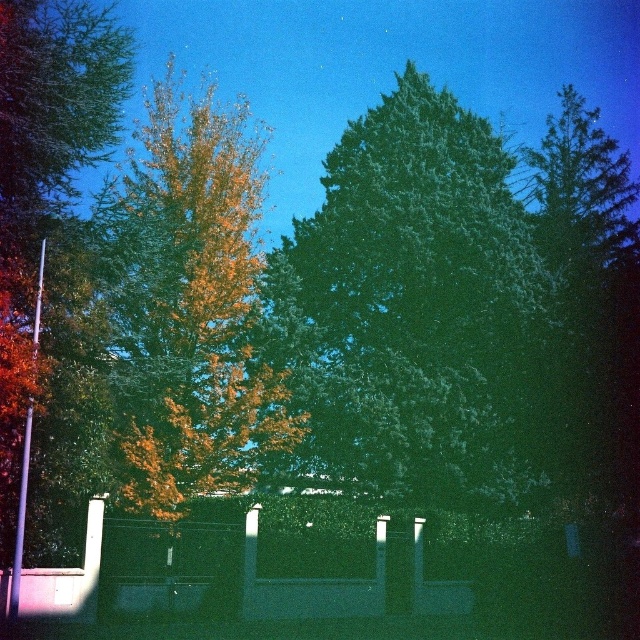
Who is taller, green leafy tree at center or golden yellow leaves at center?

Standing taller between the two is golden yellow leaves at center.

Who is more forward, (492, 385) or (193, 301)?

Positioned in front is point (193, 301).

Between point (400, 204) and point (225, 212), which one is positioned in front?

Point (225, 212)

You are a GUI agent. You are given a task and a screenshot of the screen. Output one action in this format:
    pyautogui.click(x=<x>, y=<y>)
    Task: Click on the green leafy tree at center
    
    Given the screenshot: What is the action you would take?
    pyautogui.click(x=416, y=310)